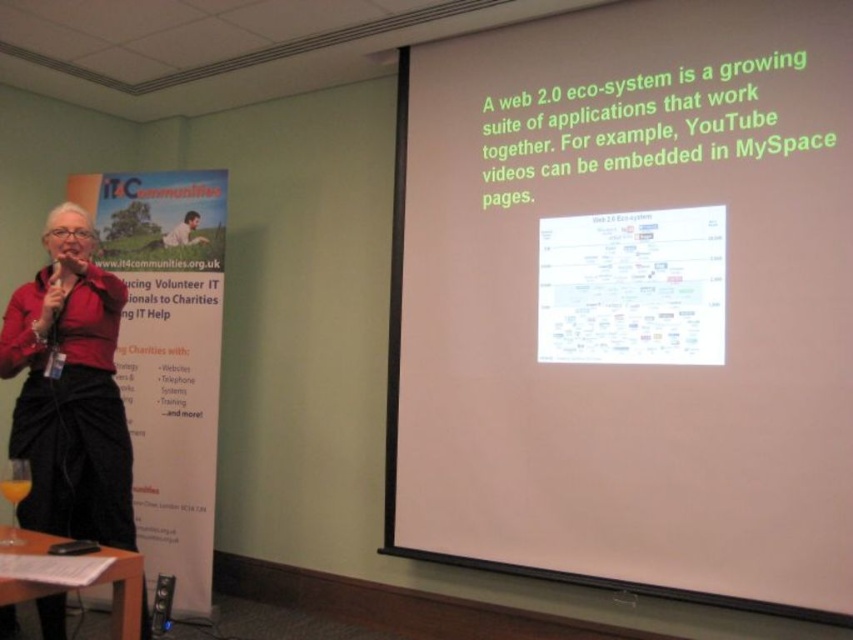
Based on the scene description, where is the white matte projection screen at center located in terms of coordinates?

The white matte projection screen at center is located at coordinates point (x=630, y=301).